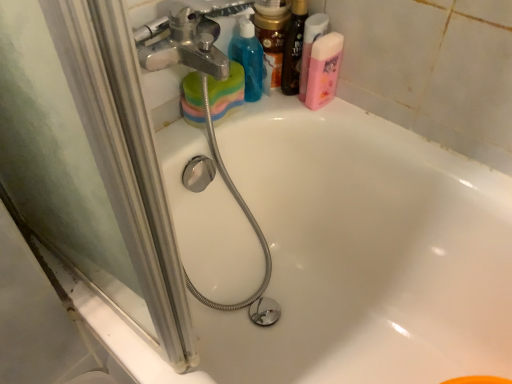
Locate an element on the screen. This screenshot has height=384, width=512. vacant area that is in front of pink matte shaving cream at upper right is located at coordinates (323, 118).